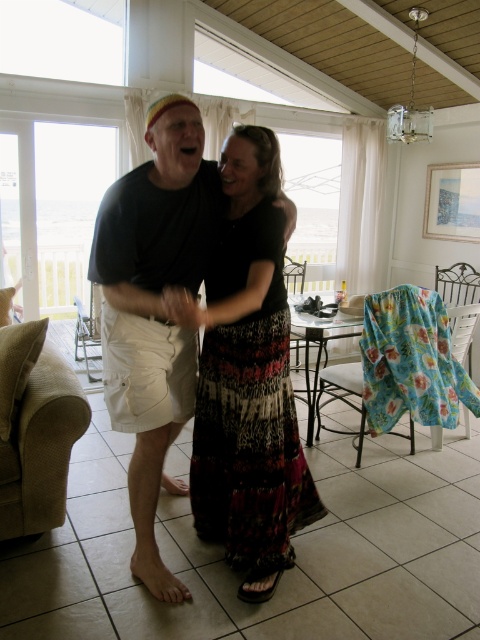
This screenshot has width=480, height=640. What do you see at coordinates (36, 429) in the screenshot?
I see `beige fabric armchair at lower left` at bounding box center [36, 429].

Who is lower down, beige fabric armchair at lower left or white fabric armchair at left?

beige fabric armchair at lower left is below.

Which is in front, point (14, 346) or point (94, 301)?

Point (14, 346) is in front.

Identify the location of beige fabric armchair at lower left. This screenshot has height=640, width=480. (36, 429).

The image size is (480, 640). What do you see at coordinates (250, 410) in the screenshot?
I see `printed fabric dress at center` at bounding box center [250, 410].

Between point (231, 541) and point (64, 442), which one is positioned in front?

Point (231, 541)

I want to click on printed fabric dress at center, so click(x=250, y=410).

The image size is (480, 640). Describe the element at coordinates (155, 307) in the screenshot. I see `matte black t-shirt at center` at that location.

Measure the distance between point (179, 275) and camera.

Point (179, 275) and camera are 2.03 meters apart from each other.

Does point (168, 420) come closer to viewer compared to point (95, 323)?

Yes.

In order to click on matte black t-shirt at center in this screenshot , I will do `click(155, 307)`.